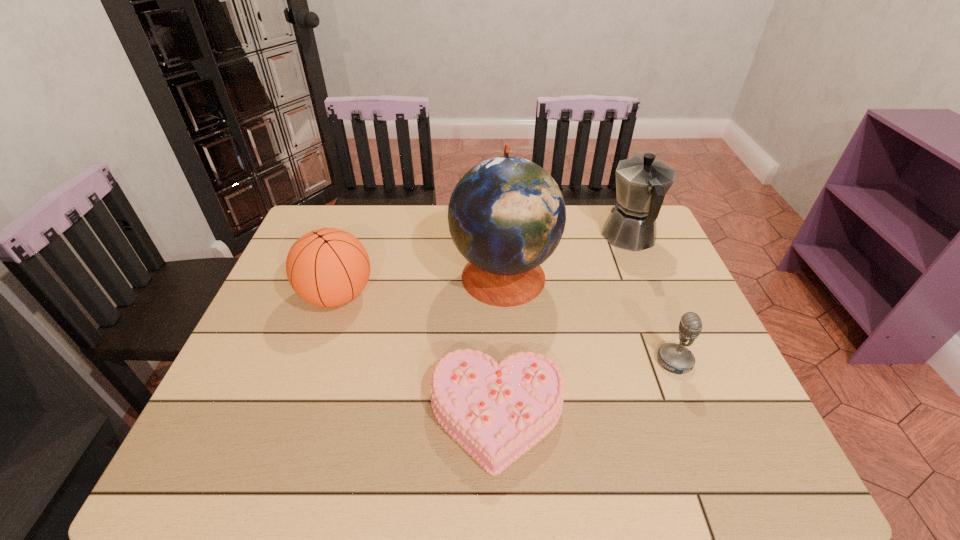
The image size is (960, 540). Find the location of `object situated at the far right corner`. object situated at the far right corner is located at coordinates [x=641, y=182].

In the image, there is a desktop. Where is `vacant space at the far edge`? The image size is (960, 540). vacant space at the far edge is located at coordinates (444, 217).

The width and height of the screenshot is (960, 540). In the image, there is a desktop. In order to click on blank space at the near edge in this screenshot , I will do `click(635, 463)`.

In the image, there is a desktop. Identify the location of vacant space at the left edge. This screenshot has width=960, height=540. (233, 424).

Image resolution: width=960 pixels, height=540 pixels. In order to click on vacant region at the right edge in this screenshot , I will do `click(702, 408)`.

Locate an element on the screen. blank space at the far right corner is located at coordinates (608, 206).

This screenshot has width=960, height=540. What are the coordinates of `free point at the near right corner` in the screenshot? It's located at (756, 478).

This screenshot has width=960, height=540. I want to click on blank region between the cake and the second tallest object, so click(x=564, y=326).

I want to click on free space between the microphone and the coffeepot, so click(x=652, y=299).

Locate an element on the screen. Image resolution: width=960 pixels, height=540 pixels. free spot between the cake and the fourth shortest object is located at coordinates (564, 326).